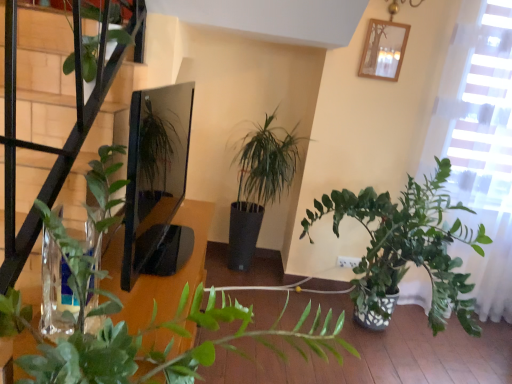
Question: Is wooden picture frame at upper center further to the viewer compared to green leafy plant at upper left?

Choices:
 (A) yes
 (B) no

Answer: (A)

Question: Is wooden picture frame at upper center bigger than green leafy plant at upper left?

Choices:
 (A) no
 (B) yes

Answer: (A)

Question: Considering the relative sizes of wooden picture frame at upper center and green leafy plant at upper left in the image provided, is wooden picture frame at upper center smaller than green leafy plant at upper left?

Choices:
 (A) no
 (B) yes

Answer: (B)

Question: Does wooden picture frame at upper center have a greater width compared to green leafy plant at upper left?

Choices:
 (A) no
 (B) yes

Answer: (A)

Question: From a real-world perspective, is wooden picture frame at upper center beneath green leafy plant at upper left?

Choices:
 (A) no
 (B) yes

Answer: (A)

Question: In the image, is green leafy plant at upper left positioned in front of or behind wooden picture frame at upper center?

Choices:
 (A) behind
 (B) front

Answer: (B)

Question: Considering the positions of green leafy plant at upper left and wooden picture frame at upper center in the image, is green leafy plant at upper left taller or shorter than wooden picture frame at upper center?

Choices:
 (A) tall
 (B) short

Answer: (A)

Question: From a real-world perspective, is green leafy plant at upper left physically located above or below wooden picture frame at upper center?

Choices:
 (A) above
 (B) below

Answer: (B)

Question: From the image's perspective, relative to wooden picture frame at upper center, is green leafy plant at upper left above or below?

Choices:
 (A) below
 (B) above

Answer: (A)

Question: Considering the positions of wooden picture frame at upper center and green leafy plant at upper left in the image, is wooden picture frame at upper center wider or thinner than green leafy plant at upper left?

Choices:
 (A) thin
 (B) wide

Answer: (A)

Question: Which is correct: wooden picture frame at upper center is inside green leafy plant at upper left, or outside of it?

Choices:
 (A) outside
 (B) inside

Answer: (A)

Question: From the image's perspective, is wooden picture frame at upper center positioned above or below green leafy plant at upper left?

Choices:
 (A) above
 (B) below

Answer: (A)

Question: Is wooden picture frame at upper center in front of or behind green leafy plant at upper left in the image?

Choices:
 (A) front
 (B) behind

Answer: (B)

Question: Is green matte plant at center wider or thinner than green leafy plant at upper left?

Choices:
 (A) thin
 (B) wide

Answer: (B)

Question: From a real-world perspective, relative to green leafy plant at upper left, is green matte plant at center vertically above or below?

Choices:
 (A) below
 (B) above

Answer: (A)